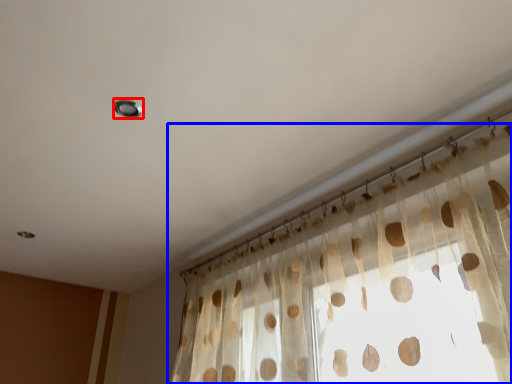
Question: Which object appears farthest to the camera in this image, light (highlighted by a red box) or curtain (highlighted by a blue box)?

Choices:
 (A) light
 (B) curtain

Answer: (A)